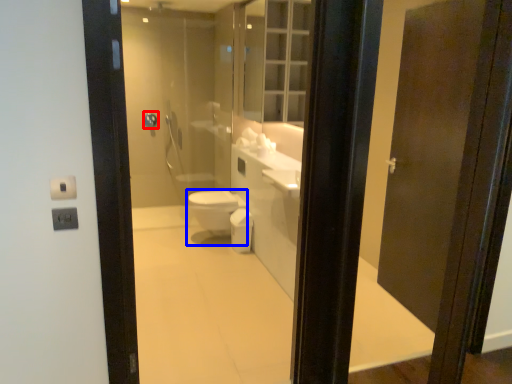
Question: Which point is closer to the camera, towel bar (highlighted by a red box) or bidet (highlighted by a blue box)?

Choices:
 (A) towel bar
 (B) bidet

Answer: (B)